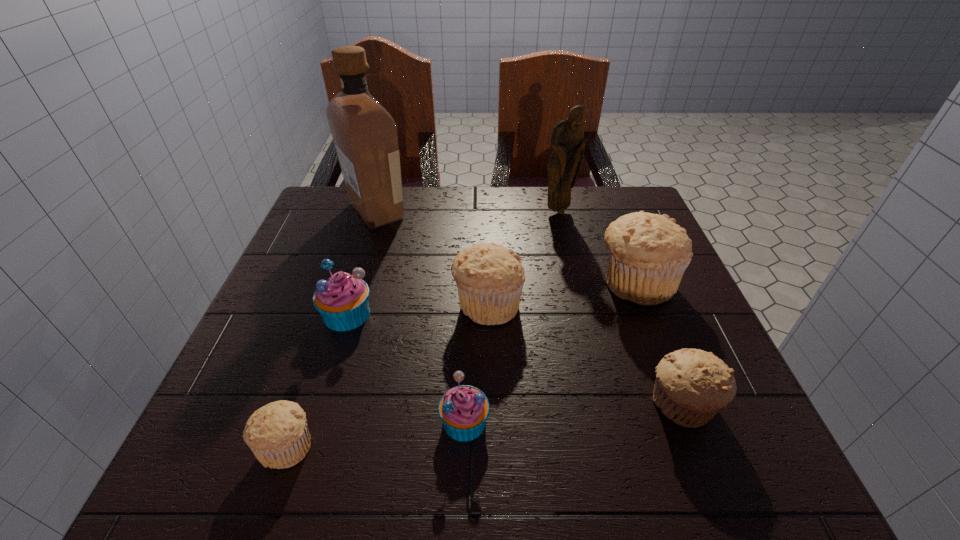
Where is `vacant area at the left edge of the desktop`? The height and width of the screenshot is (540, 960). vacant area at the left edge of the desktop is located at coordinates point(216,422).

This screenshot has height=540, width=960. In the image, there is a desktop. What are the coordinates of `free space at the right edge` in the screenshot? It's located at (656, 356).

In the image, there is a desktop. Identify the location of vacant space at the far left corner. This screenshot has width=960, height=540. (327, 204).

Locate an element on the screen. The height and width of the screenshot is (540, 960). free space at the far right corner of the desktop is located at coordinates (605, 207).

Where is `free space at the near right corner`? The height and width of the screenshot is (540, 960). free space at the near right corner is located at coordinates pos(767,451).

This screenshot has width=960, height=540. What are the coordinates of `vacant space in between the liquor and the second smallest beige muffin` in the screenshot? It's located at (528, 308).

Find the location of a particular element. This screenshot has width=960, height=540. free space between the leftmost beige muffin and the left blue muffin is located at coordinates (317, 380).

This screenshot has width=960, height=540. In order to click on empty space between the nearer blue muffin and the tallest muffin in this screenshot , I will do `click(550, 352)`.

Where is `free space that is in between the farther blue muffin and the right blue muffin`? The width and height of the screenshot is (960, 540). free space that is in between the farther blue muffin and the right blue muffin is located at coordinates (406, 368).

Image resolution: width=960 pixels, height=540 pixels. Identify the location of vacant region between the sixth object from left to right and the brown liquor. (468, 211).